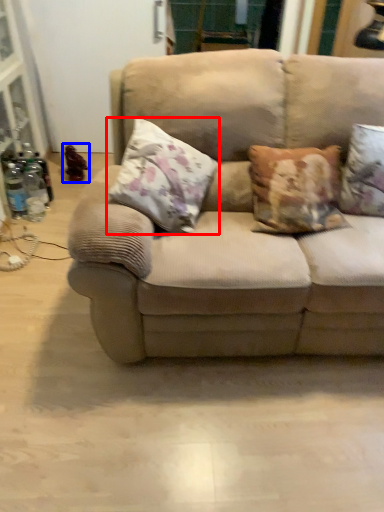
Question: Which object appears farthest to the camera in this image, pillow (highlighted by a red box) or toy (highlighted by a blue box)?

Choices:
 (A) pillow
 (B) toy

Answer: (B)